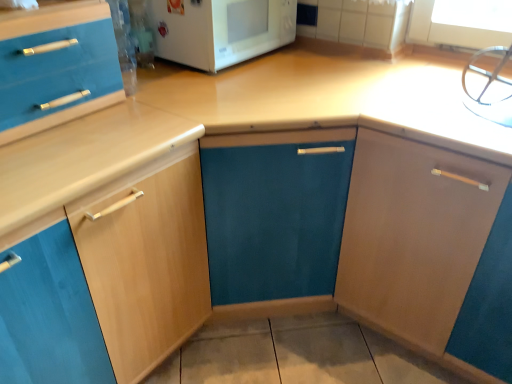
Where is `vacant region above light wood cabinet at left, arranged as the 2th cabinetry when viewed from the right (from a real-world perspective)`? The width and height of the screenshot is (512, 384). vacant region above light wood cabinet at left, arranged as the 2th cabinetry when viewed from the right (from a real-world perspective) is located at coordinates (70, 144).